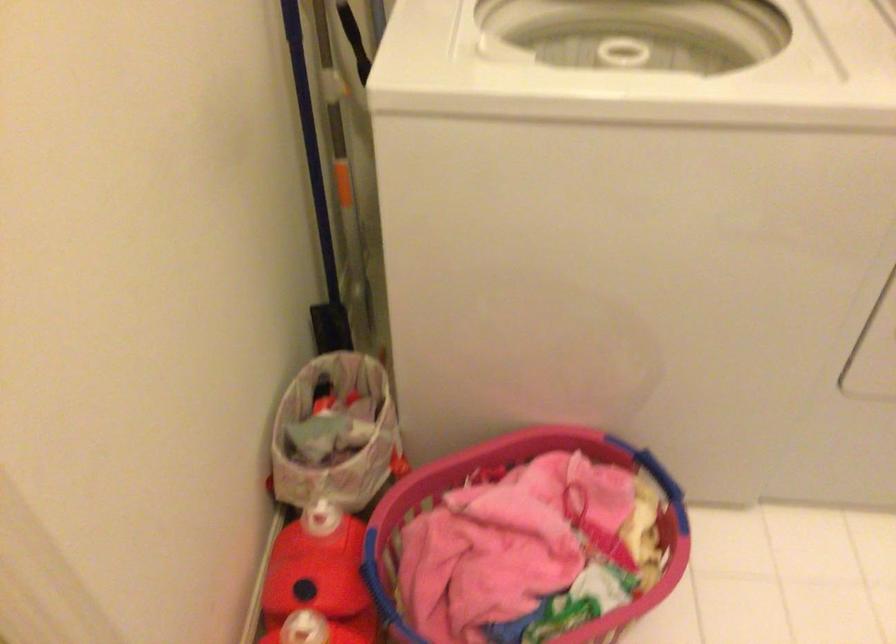
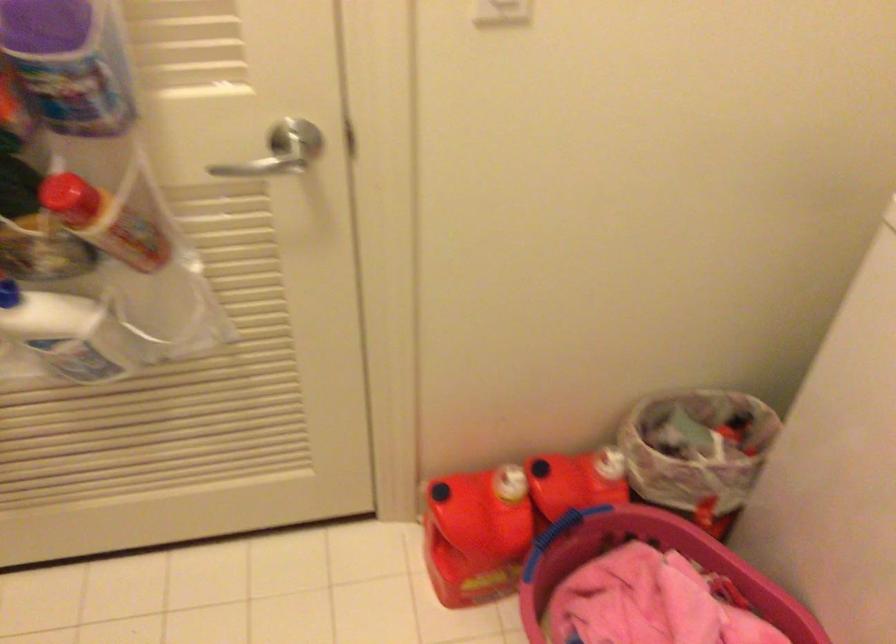
In the second image, find the point that corresponds to point 494,545 in the first image.

(651, 603)